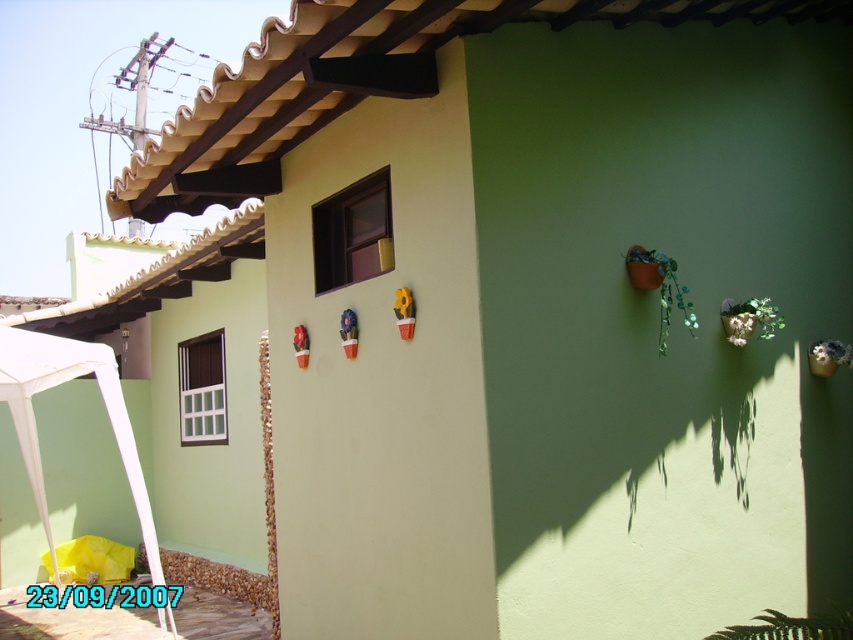
Who is lower down, green matte plant at upper right or green leafy plant at lower right?

green leafy plant at lower right

How far apart are green matte plant at upper right and green leafy plant at lower right?

The distance of green matte plant at upper right from green leafy plant at lower right is 1.70 meters.

Where is `green matte plant at upper right`? green matte plant at upper right is located at coordinates (660, 288).

Image resolution: width=853 pixels, height=640 pixels. I want to click on green matte plant at upper right, so click(x=660, y=288).

Find the location of a particular element. The width and height of the screenshot is (853, 640). green matte plant at upper right is located at coordinates (660, 288).

Is point (676, 289) positioned before point (752, 323)?

Yes, point (676, 289) is closer to viewer.

Is point (637, 262) positioned in front of point (747, 328)?

Yes, it is in front of point (747, 328).

Where is `green matte plant at upper right`? green matte plant at upper right is located at coordinates pos(660,288).

Can you confirm if green leafy plant at lower right is bigger than green glossy planter at right?

Yes.

Between point (767, 616) and point (727, 336), which one is positioned in front?

Point (767, 616) is more forward.

Describe the element at coordinates (791, 627) in the screenshot. The height and width of the screenshot is (640, 853). I see `green leafy plant at lower right` at that location.

This screenshot has height=640, width=853. Identify the location of green leafy plant at lower right. (791, 627).